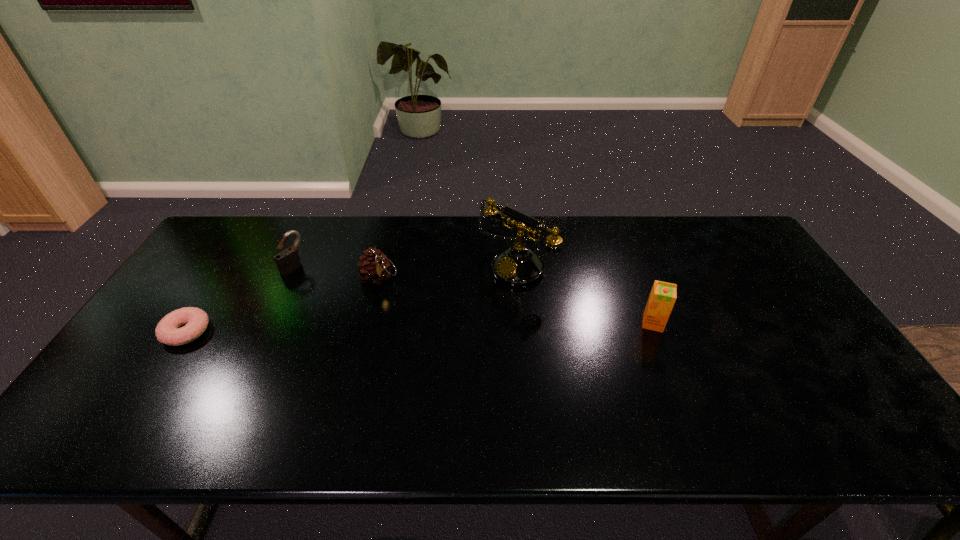
Identify the location of vacant point located between the pinecone and the tallest object. This screenshot has height=540, width=960. (447, 272).

The image size is (960, 540). What are the coordinates of `free space between the second object from left to right and the third object from left to right` in the screenshot? It's located at (337, 272).

Find the location of a particular element. The image size is (960, 540). empty space between the pinecone and the second object from right to left is located at coordinates (x=447, y=272).

Locate an element on the screen. free point between the fourth object from right to left and the telephone is located at coordinates (405, 267).

At what (x,y) coordinates should I click in order to perform the action: click on unoccupied position between the orange juice and the leftmost object. Please return your answer as a coordinate pair (x, y). The height and width of the screenshot is (540, 960). Looking at the image, I should click on click(x=420, y=327).

Find the location of a particular element. The width and height of the screenshot is (960, 540). free spot between the third object from right to left and the tallest object is located at coordinates (447, 272).

Identify the location of vacant space in between the second object from left to right and the leftmost object. (240, 299).

Locate which object ranks second in proximity to the shortest object. Please provide its 2D coordinates. Your answer should be formatted as a tuple, i.e. [(x, y)], where the tuple contains the x and y coordinates of a point satisfying the conditions above.

[(375, 268)]

At what (x,y) coordinates should I click in order to perform the action: click on object that is the second closest to the fourth object from left to right. Please return your answer as a coordinate pair (x, y). This screenshot has height=540, width=960. Looking at the image, I should click on (375, 268).

Identify the location of free region that satisfies the following two spatial constraints: 1. on the back side of the third object from left to right; 2. on the right side of the leftmost object. (222, 278).